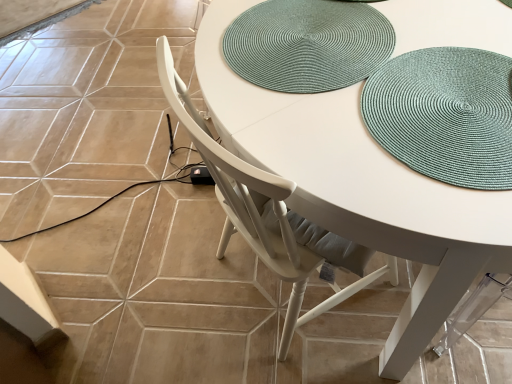
Locate an element on the screen. Image resolution: width=512 pixels, height=384 pixels. free location in front of teal woven placemat at upper center is located at coordinates (362, 142).